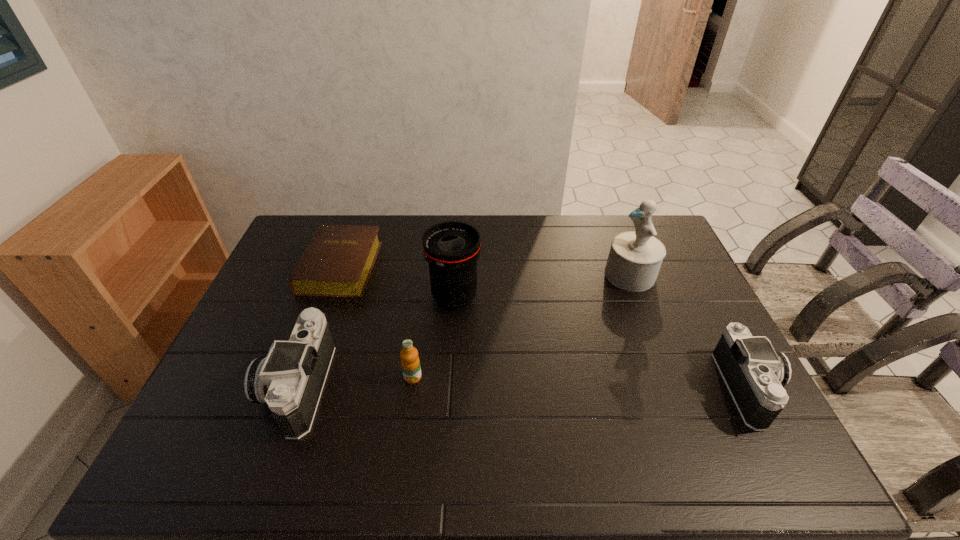
This screenshot has height=540, width=960. Identify the location of camera situated at the right edge. (755, 373).

This screenshot has height=540, width=960. I want to click on figurine located at the right edge, so click(x=635, y=257).

Where is `object that is at the far left corner`? The image size is (960, 540). object that is at the far left corner is located at coordinates (337, 262).

Find the location of a particular element. object located in the near left corner section of the desktop is located at coordinates (291, 378).

Where is `object that is positioned at the near right corner`? The height and width of the screenshot is (540, 960). object that is positioned at the near right corner is located at coordinates (755, 373).

In the image, there is a desktop. At what (x,y) coordinates should I click in order to perform the action: click on vacant space at the far edge. Please return your answer as a coordinate pair (x, y). Image resolution: width=960 pixels, height=540 pixels. Looking at the image, I should click on (378, 238).

This screenshot has height=540, width=960. Find the location of `vacant space at the near edge`. vacant space at the near edge is located at coordinates (420, 404).

Image resolution: width=960 pixels, height=540 pixels. Find the location of `vacant space at the left edge`. vacant space at the left edge is located at coordinates (267, 306).

The width and height of the screenshot is (960, 540). Identify the location of blank area at the right edge. (699, 330).

Locate an element on the screen. The width and height of the screenshot is (960, 540). vacant space at the near left corner of the desktop is located at coordinates (211, 419).